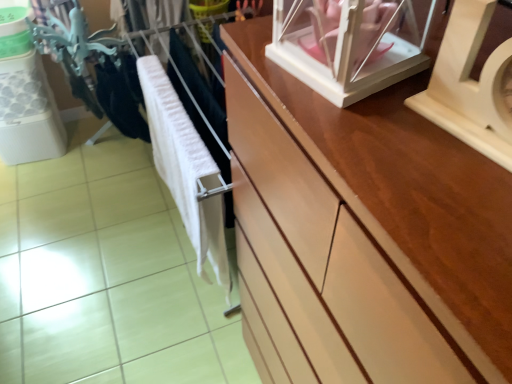
Find the location of `white soft cloth at center`. white soft cloth at center is located at coordinates [x=185, y=169].

At what (x,y) coordinates should I click in order to perform the action: click on wooden clock at upper right. Please return your answer as a coordinate pair (x, y). This screenshot has width=512, height=384. Looking at the image, I should click on (470, 85).

Measure the distance between white glossy glass box at upper right and camera.

A distance of 19.50 inches exists between white glossy glass box at upper right and camera.

This screenshot has height=384, width=512. Describe the element at coordinates (348, 44) in the screenshot. I see `white glossy glass box at upper right` at that location.

The width and height of the screenshot is (512, 384). Find the location of `white soft cloth at center`. white soft cloth at center is located at coordinates (185, 169).

In terms of width, does white glossy glass box at upper right look wider or thinner when compared to white soft cloth at center?

Clearly, white glossy glass box at upper right has more width compared to white soft cloth at center.

What's the angular difference between white glossy glass box at upper right and white soft cloth at center's facing directions?

9.63 degrees separate the facing orientations of white glossy glass box at upper right and white soft cloth at center.

Could you tell me if white glossy glass box at upper right is turned towards white soft cloth at center?

No, white glossy glass box at upper right is not facing towards white soft cloth at center.

Can you confirm if white glossy glass box at upper right is positioned to the left of white soft cloth at center?

No, white glossy glass box at upper right is not to the left of white soft cloth at center.

Which is more to the right, white glossy glass box at upper right or wooden clock at upper right?

Positioned to the right is wooden clock at upper right.

From a real-world perspective, does white glossy glass box at upper right sit lower than wooden clock at upper right?

Incorrect, from a real-world perspective, white glossy glass box at upper right is higher than wooden clock at upper right.

Does white glossy glass box at upper right touch wooden clock at upper right?

white glossy glass box at upper right and wooden clock at upper right are clearly separated.

Who is shorter, white soft cloth at center or wooden clock at upper right?

wooden clock at upper right.

Is white soft cloth at center not near wooden clock at upper right?

They are positioned close to each other.

From a real-world perspective, is white soft cloth at center above or below wooden clock at upper right?

white soft cloth at center is situated lower than wooden clock at upper right in the real world.

Which object is positioned more to the left, white soft cloth at center or wooden clock at upper right?

Positioned to the left is white soft cloth at center.

Based on the photo, can you tell me how much wooden clock at upper right and white glossy glass box at upper right differ in facing direction?

The angular difference between wooden clock at upper right and white glossy glass box at upper right is 1.36 degrees.

From the image's perspective, is wooden clock at upper right above or below white glossy glass box at upper right?

wooden clock at upper right is situated lower than white glossy glass box at upper right in the image.

Is wooden clock at upper right shorter than white glossy glass box at upper right?

No.

Is wooden clock at upper right to the left or to the right of white glossy glass box at upper right in the image?

wooden clock at upper right is positioned on white glossy glass box at upper right's right side.

Locate an element on the screen. baby clothe that appears on the left of wooden clock at upper right is located at coordinates (185, 169).

Is white soft cloth at center inside wooden clock at upper right?

No, white soft cloth at center is not inside wooden clock at upper right.

From the image's perspective, is wooden clock at upper right below white soft cloth at center?

No, from the image's perspective, wooden clock at upper right is not beneath white soft cloth at center.

Is point (459, 13) more distant than point (164, 105)?

No, it is in front of (164, 105).

Does white soft cloth at center appear on the left side of white glossy glass box at upper right?

Correct, you'll find white soft cloth at center to the left of white glossy glass box at upper right.

Measure the distance between white soft cloth at center and white glossy glass box at upper right.

white soft cloth at center and white glossy glass box at upper right are 26.74 inches apart.

From the image's perspective, does white soft cloth at center appear lower than white glossy glass box at upper right?

Yes.

Where is `glass box located in front of the white soft cloth at center`? Image resolution: width=512 pixels, height=384 pixels. glass box located in front of the white soft cloth at center is located at coordinates (348, 44).

I want to click on glass box that is above the wooden clock at upper right (from a real-world perspective), so click(x=348, y=44).

In the scene shown: Based on their spatial positions, is wooden clock at upper right or white soft cloth at center closer to white glossy glass box at upper right?

Based on the image, wooden clock at upper right appears to be nearer to white glossy glass box at upper right.

Considering their positions, is white soft cloth at center positioned further to white glossy glass box at upper right than wooden clock at upper right?

white soft cloth at center is positioned further to the anchor white glossy glass box at upper right.

In the scene shown: Considering their positions, is white glossy glass box at upper right positioned further to white soft cloth at center than wooden clock at upper right?

The object further to white soft cloth at center is wooden clock at upper right.

Looking at the image, which one is located closer to wooden clock at upper right, white glossy glass box at upper right or white soft cloth at center?

white glossy glass box at upper right.

Estimate the real-world distances between objects in this image. Which object is further from white soft cloth at center, wooden clock at upper right or white glossy glass box at upper right?

wooden clock at upper right lies further to white soft cloth at center than the other object.

From the picture: Considering their positions, is white soft cloth at center positioned closer to wooden clock at upper right than white glossy glass box at upper right?

Among the two, white glossy glass box at upper right is located nearer to wooden clock at upper right.

The image size is (512, 384). Identify the location of glass box between wooden clock at upper right and white soft cloth at center in the front-back direction. (348, 44).